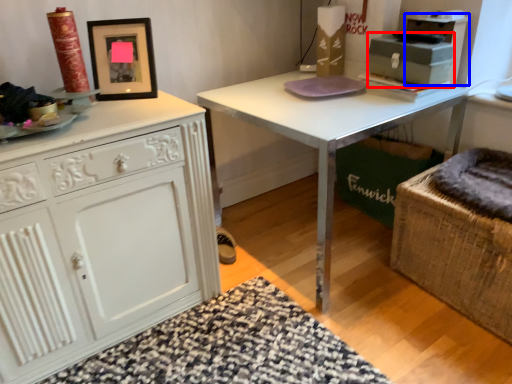
Question: Which of the following is the farthest to the observer, box (highlighted by a red box) or cabinetry (highlighted by a blue box)?

Choices:
 (A) box
 (B) cabinetry

Answer: (B)